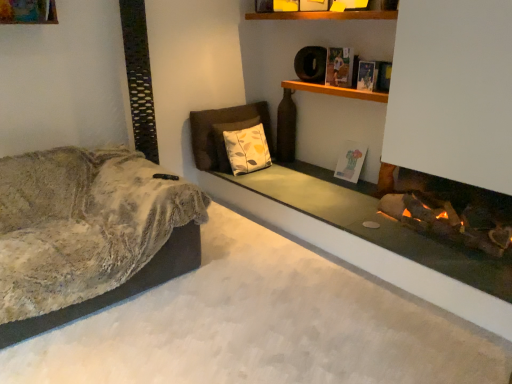
Find the location of a particular element. free space above smooth concrete fireplace at lower right (from a real-world perspective) is located at coordinates (347, 200).